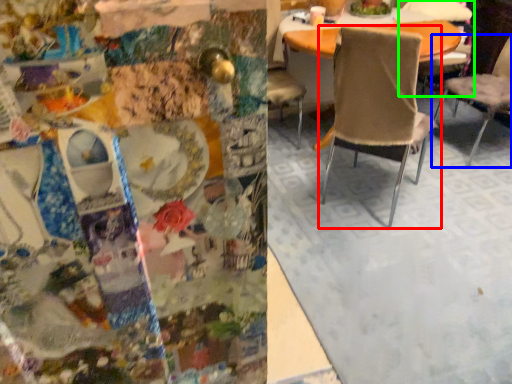
Question: Which object is the farthest from chair (highlighted by a red box)? Choose among these: chair (highlighted by a blue box) or chair (highlighted by a green box).

Choices:
 (A) chair
 (B) chair

Answer: (B)